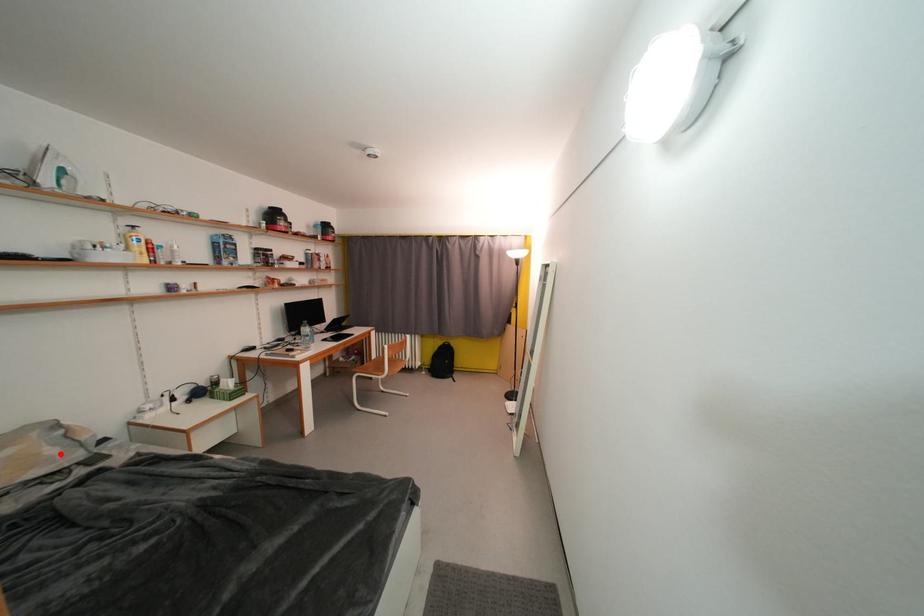
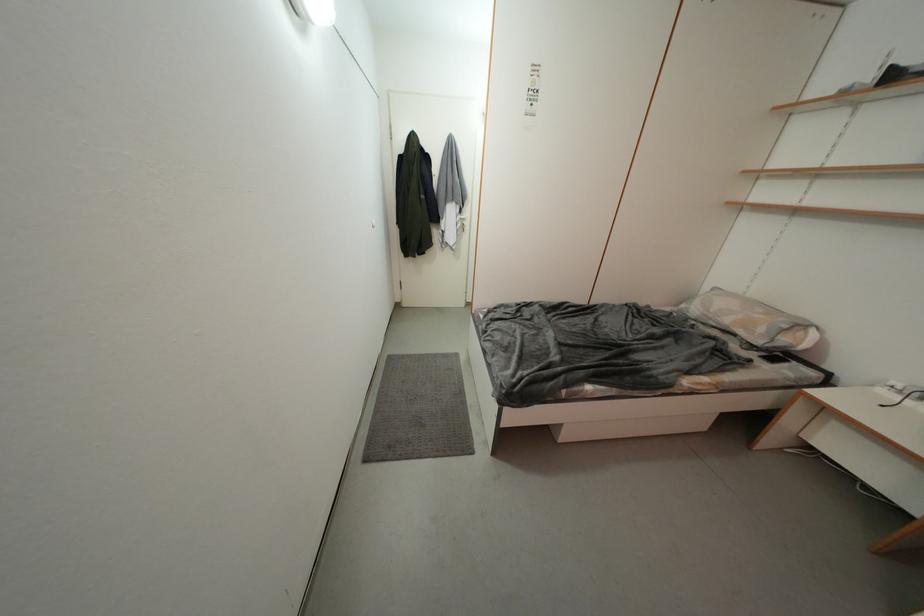
Question: I am providing you with two images of the same scene from different viewpoints. Given a red point in image1, look at the same physical point in image2. Is it:

Choices:
 (A) Closer to the viewpoint
 (B) Farther from the viewpoint

Answer: (B)